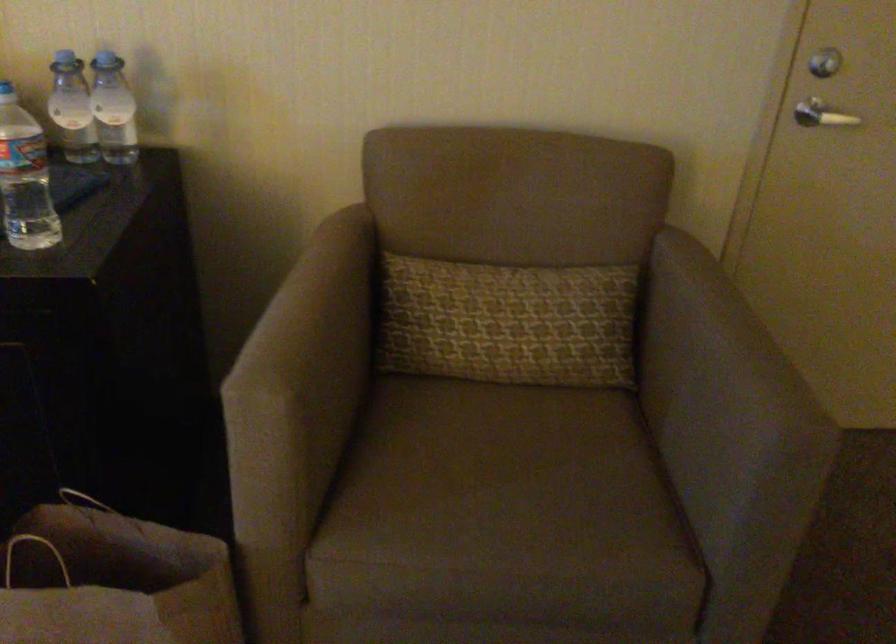
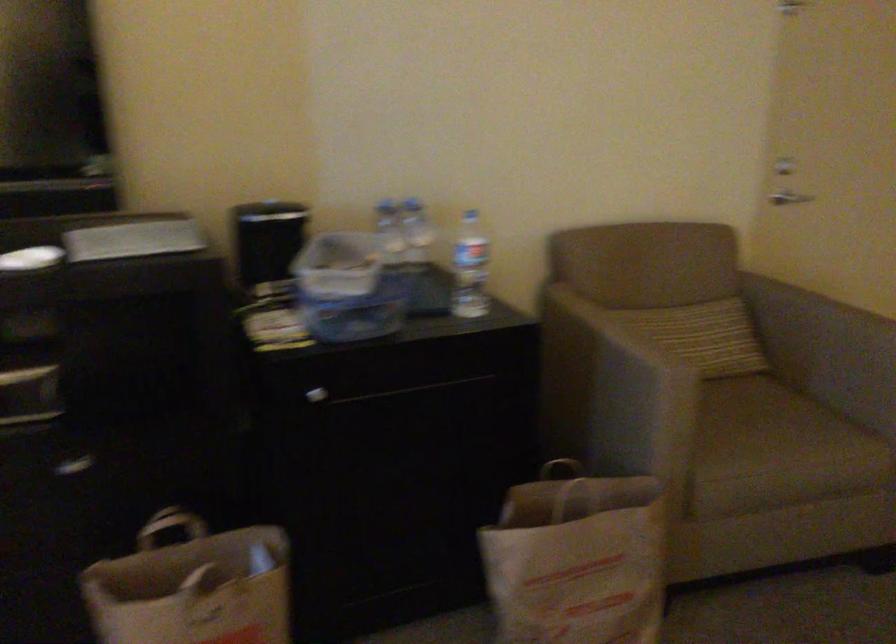
Where in the second image is the point corresponding to (673,319) from the first image?

(807, 308)